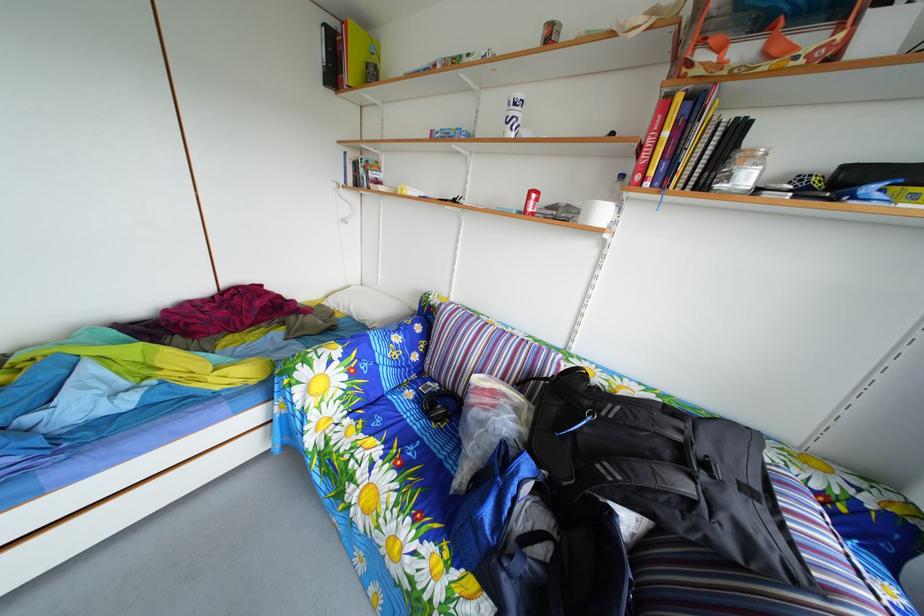
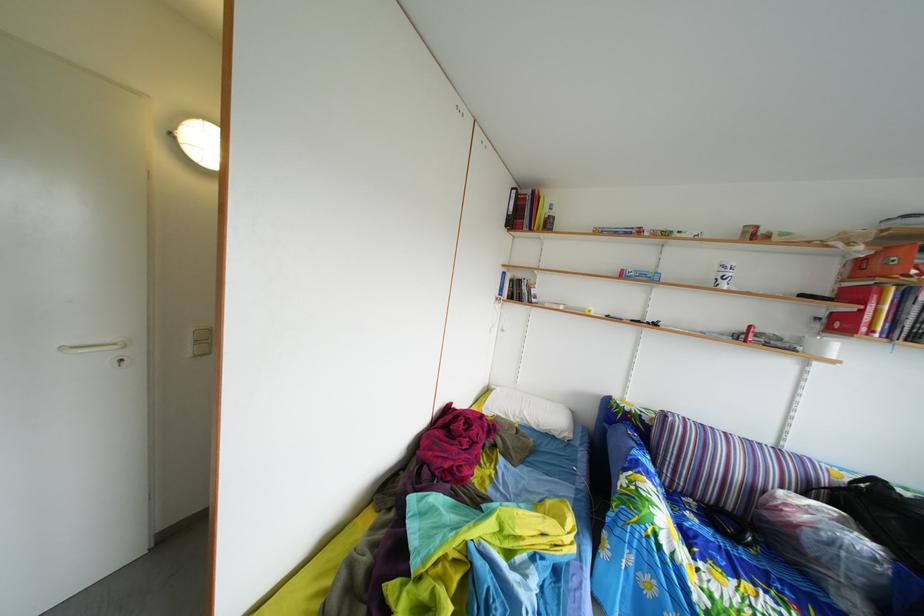
In the second image, find the point that corresponds to point 470,400 in the first image.

(739, 516)